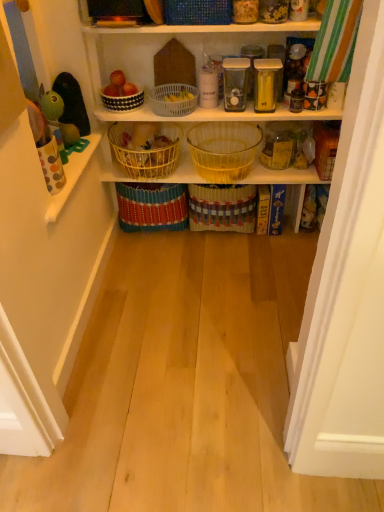
I want to click on vacant space underneath white dotted bowl at upper center, placed as the second basket when sorted from top to bottom (from a real-world perspective), so click(x=130, y=108).